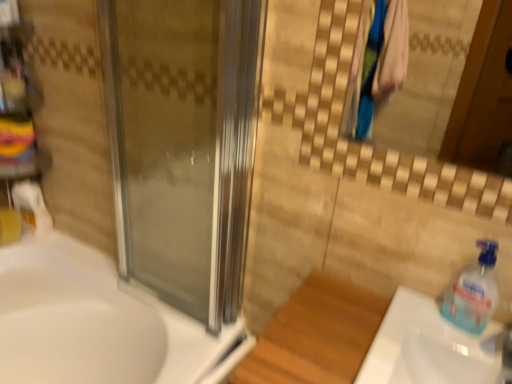
The width and height of the screenshot is (512, 384). What are the coordinates of `free region under transparent glass screen door at center (from a real-world perspective)` in the screenshot? It's located at (160, 309).